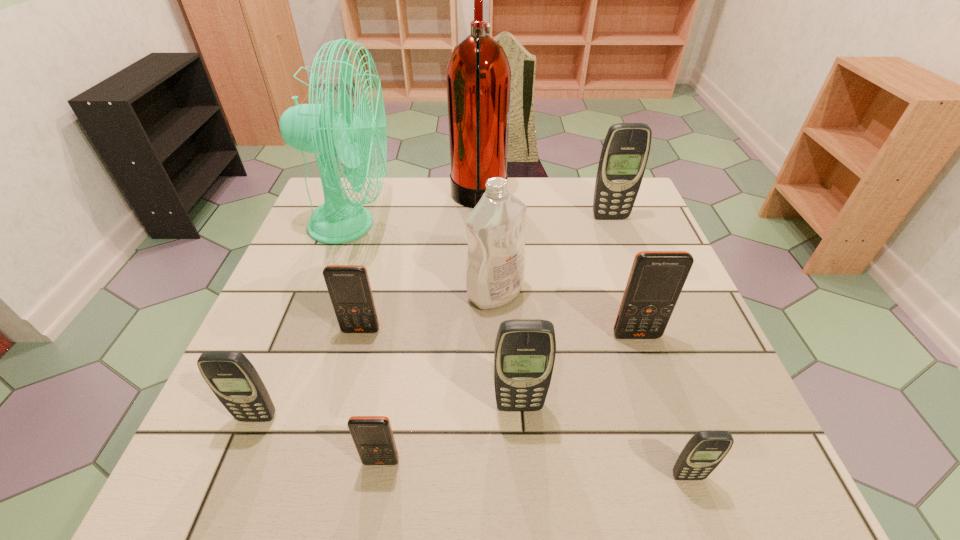
Where is `vacant area that lies between the blue fan and the third nearest object`? The width and height of the screenshot is (960, 540). vacant area that lies between the blue fan and the third nearest object is located at coordinates (304, 321).

Where is `blank region between the blue fan and the third cellular telephone from left to right`? The width and height of the screenshot is (960, 540). blank region between the blue fan and the third cellular telephone from left to right is located at coordinates (366, 343).

The image size is (960, 540). In order to click on vacant space that is in between the second biggest orange cellular telephone and the red fire extinguisher in this screenshot , I will do `click(420, 265)`.

The image size is (960, 540). I want to click on empty space between the leftmost orange cellular telephone and the red fire extinguisher, so click(420, 265).

Image resolution: width=960 pixels, height=540 pixels. In order to click on free space between the farthest cellular telephone and the third nearest gray cellular telephone in this screenshot , I will do `click(564, 312)`.

Where is `object identified as the third closest to the red fire extinguisher`? This screenshot has height=540, width=960. object identified as the third closest to the red fire extinguisher is located at coordinates (625, 151).

This screenshot has height=540, width=960. I want to click on the fifth closest object to the nearest object, so click(349, 288).

This screenshot has width=960, height=540. In order to click on cellular telephone that stands as the third closest to the fourth nearest cellular telephone in this screenshot , I will do `click(705, 450)`.

Locate which cellular telephone is the fifth closest to the biggest orange cellular telephone. Please provide its 2D coordinates. Your answer should be formatted as a tuple, i.e. [(x, y)], where the tuple contains the x and y coordinates of a point satisfying the conditions above.

[(349, 288)]

Choose which gray cellular telephone is the nearest neighbor to the second orange cellular telephone from left to right. Please provide its 2D coordinates. Your answer should be formatted as a tuple, i.e. [(x, y)], where the tuple contains the x and y coordinates of a point satisfying the conditions above.

[(525, 349)]